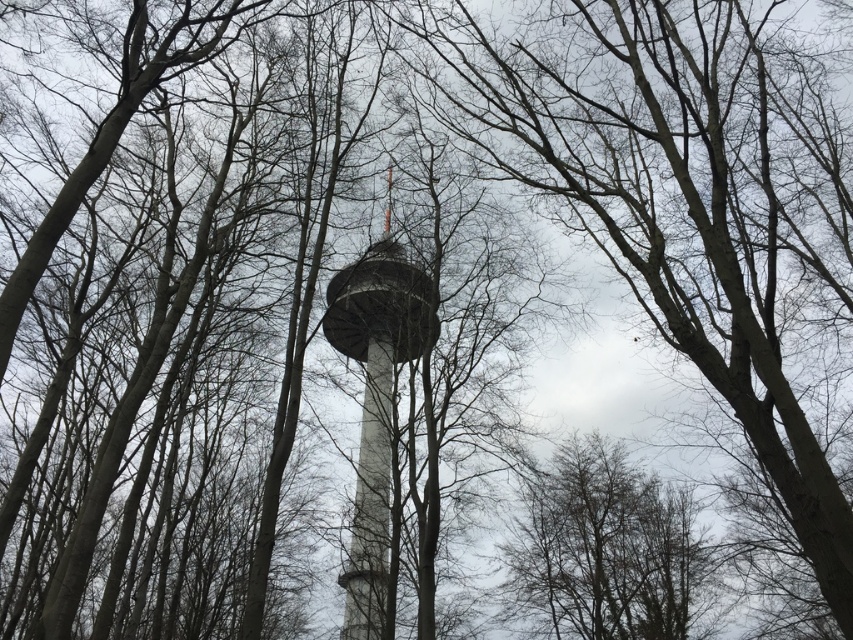
What is the exact coordinate of the brown textured tree at center in the image?

The brown textured tree at center is located at point (604, 550).

You are navigating through the dense forest towards the tall tower. You have two points marked on your map, point A at coordinates point (628, 600) and point B at coordinates point (361, 465). Which point should you reach first if you want to approach the tower from the front?

Point B at coordinates point (361, 465) should be reached first because point A at coordinates point 0.937, 0.737 is behind point B, meaning B is closer to the tower and in front of A.

You are an environmental scientist assessing the forest. You need to determine which object occupies more horizontal space in the image between the brown textured tree at center and the smooth white tower at center. Which one is wider?

The brown textured tree at center has a lesser width compared to the smooth white tower at center, so the smooth white tower at center is wider.